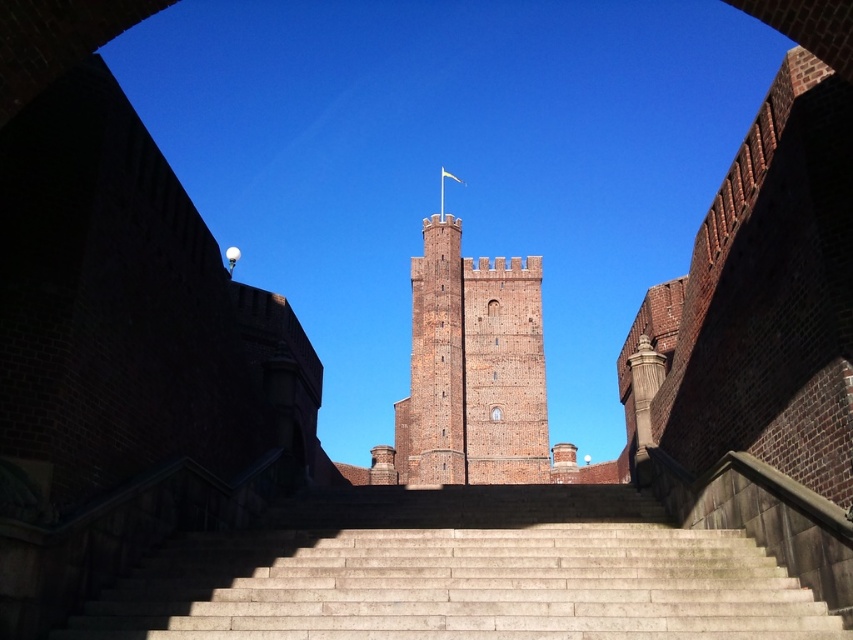
You are standing at the base of the smooth stone stairs at center and want to reach the top of the brick tower at center. Based on their heights, which structure is taller?

The brick tower at center is taller than the smooth stone stairs at center.

In the scene shown: You are standing at the base of the smooth stone stairs at center and want to reach the top of the brick tower at center. Which direction should you move to ascend towards the tower?

You should move upwards along the smooth stone stairs at center since they are positioned below the brick tower at center, leading directly towards it.

You are an architect designing a new pathway that needs to fit between the smooth stone stairs at center and the brick tower at center. Given their sizes, which one should you adjust to make more room for the pathway?

The smooth stone stairs at center occupies less space than the brick tower at center, so you should adjust the brick tower at center to make more room for the pathway.